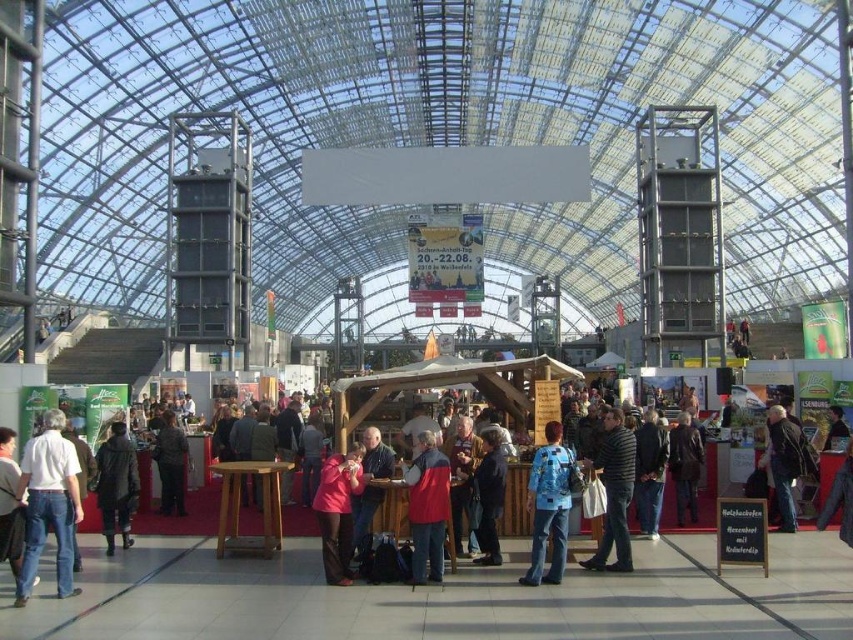
In the scene shown: You are standing at point (339,550) and want to walk to the wooden booth with a thatched roof in the foreground. Is the wooden booth with a thatched roof in the foreground located behind or in front of your current position at point (521,580)?

The wooden booth with a thatched roof in the foreground is located in front of your current position at point (521,580) because point (521,580) is in front of point (339,550).

You are a photographer at the market and want to take a photo of the white cotton shirt at lower left and dark gray textured coat at center. Which clothing item is covering part of the other in the image?

The white cotton shirt at lower left is positioned over the dark gray textured coat at center, so it is covering part of the dark gray textured coat at center.